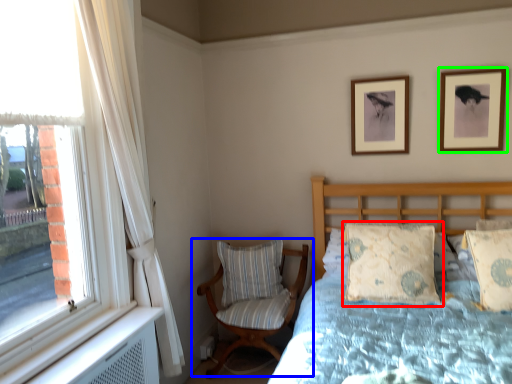
Question: Estimate the real-world distances between objects in this image. Which object is closer to pillow (highlighted by a red box), chair (highlighted by a blue box) or picture frame (highlighted by a green box)?

Choices:
 (A) chair
 (B) picture frame

Answer: (A)